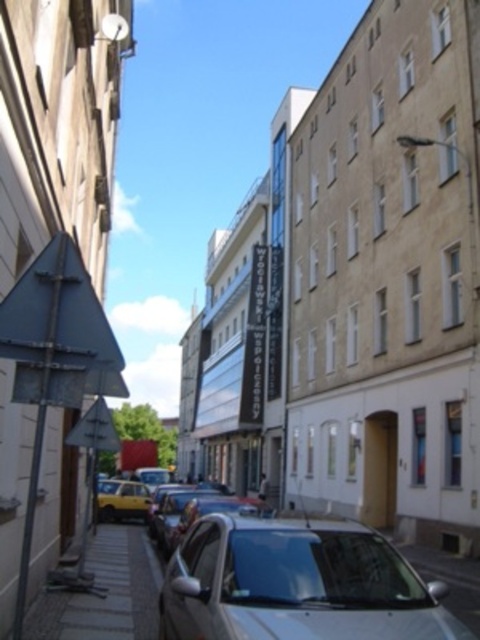
Looking at this image, you are a delivery person standing at the edge of the street in the European city scene. You need to deliver a package to a location marked by point 1 at coordinates point (273, 584) and then to point 2 at point (131, 548). Which point should you visit first to minimize backtracking?

You should visit point 1 at coordinates point (273, 584) first because it is closer to the viewer than point 2 at point (131, 548). This way, you can proceed towards point 2 without needing to backtrack since it is further away.

You are a delivery driver who needs to park your van between the silver metallic car at lower center and the yellow matte car at lower left. Your van is 5 meters long. Can you fit your van in the space between them?

The silver metallic car at lower center is smaller than the yellow matte car at lower left, but the distance between them isn not provided. Without knowing the exact space between the two cars, it is impossible to determine if the van can fit.